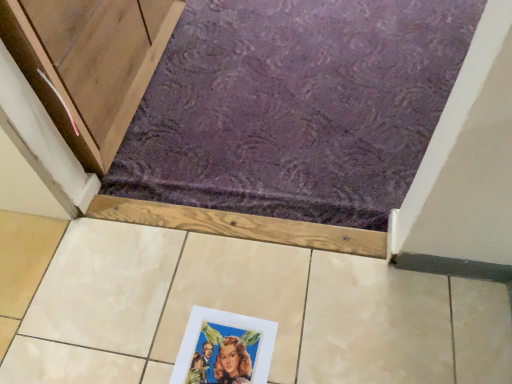
This screenshot has height=384, width=512. Find the location of `vacant point to the left of matte paper picture frame at lower center`. vacant point to the left of matte paper picture frame at lower center is located at coordinates (125, 344).